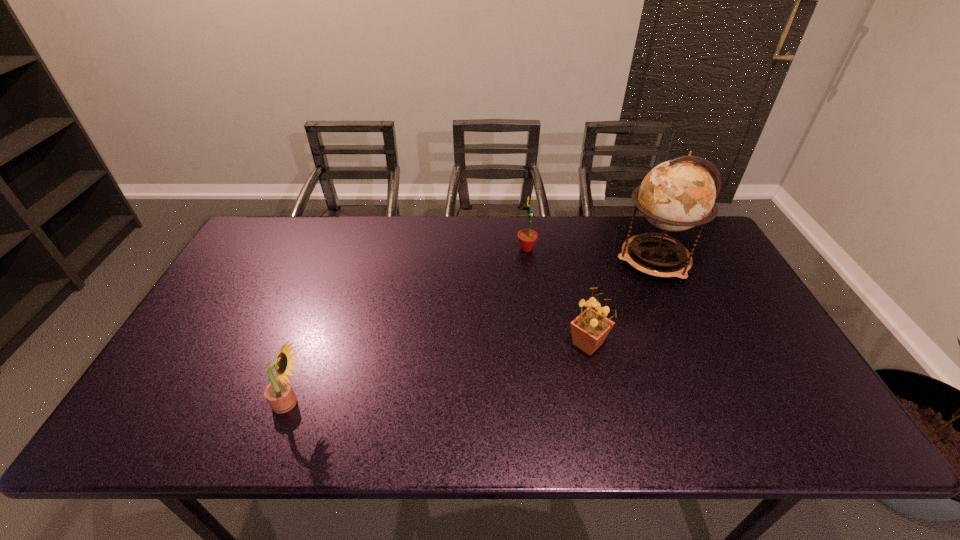
The height and width of the screenshot is (540, 960). I want to click on object that is at the far right corner, so click(676, 195).

Identify the location of vacant region at the far edge of the desktop. (389, 227).

In the image, there is a desktop. Where is `vacant space at the near edge`? This screenshot has height=540, width=960. vacant space at the near edge is located at coordinates (419, 420).

At what (x,y) coordinates should I click in order to perform the action: click on vacant space at the left edge of the desktop. Please return your answer as a coordinate pair (x, y). The width and height of the screenshot is (960, 540). Looking at the image, I should click on (221, 370).

At what (x,y) coordinates should I click in order to perform the action: click on blank area at the right edge. Please return your answer as a coordinate pair (x, y). The image size is (960, 540). Looking at the image, I should click on [x=723, y=285].

In the image, there is a desktop. Where is `vacant space at the far right corner`? vacant space at the far right corner is located at coordinates (702, 230).

Locate an element on the screen. The height and width of the screenshot is (540, 960). free space between the rightmost object and the nearest sunflower is located at coordinates (471, 332).

You are a GUI agent. You are given a task and a screenshot of the screen. Output one action in this format:
    pyautogui.click(x=<x>, y=<y>)
    Task: Click on the blank region between the second nearest sunflower and the leftmost object
    This screenshot has width=960, height=540.
    Given the screenshot: What is the action you would take?
    pyautogui.click(x=439, y=373)

Find the location of `vacant area that lies between the rightmost object and the third farthest object`. vacant area that lies between the rightmost object and the third farthest object is located at coordinates (620, 302).

Where is `vacant space that's between the second nearest object and the second sunflower from right to left`? The height and width of the screenshot is (540, 960). vacant space that's between the second nearest object and the second sunflower from right to left is located at coordinates (557, 296).